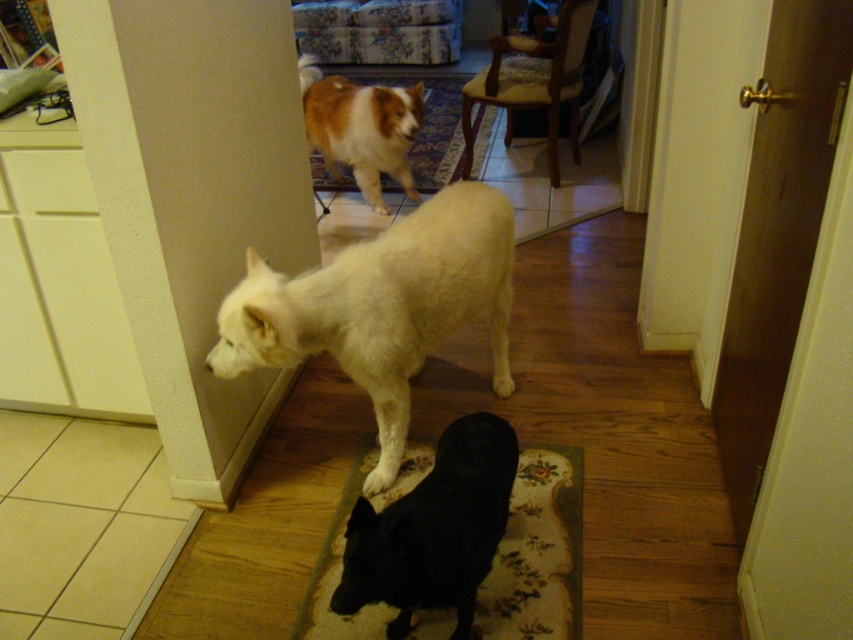
Question: Which point is closer to the camera taking this photo?

Choices:
 (A) (370, 173)
 (B) (471, 289)

Answer: (B)

Question: Considering the relative positions of floral carpet at center and brown and white fur at upper center in the image provided, where is floral carpet at center located with respect to brown and white fur at upper center?

Choices:
 (A) right
 (B) left

Answer: (A)

Question: Estimate the real-world distances between objects in this image. Which object is closer to the brown and white fur at upper center?

Choices:
 (A) floral carpet at center
 (B) white fluffy dog at center

Answer: (B)

Question: Is floral carpet at center below brown and white fur at upper center?

Choices:
 (A) no
 (B) yes

Answer: (B)

Question: Does white fluffy dog at center appear under brown and white fur at upper center?

Choices:
 (A) yes
 (B) no

Answer: (A)

Question: Estimate the real-world distances between objects in this image. Which object is closer to the white fluffy dog at center?

Choices:
 (A) floral carpet at center
 (B) brown and white fur at upper center

Answer: (A)